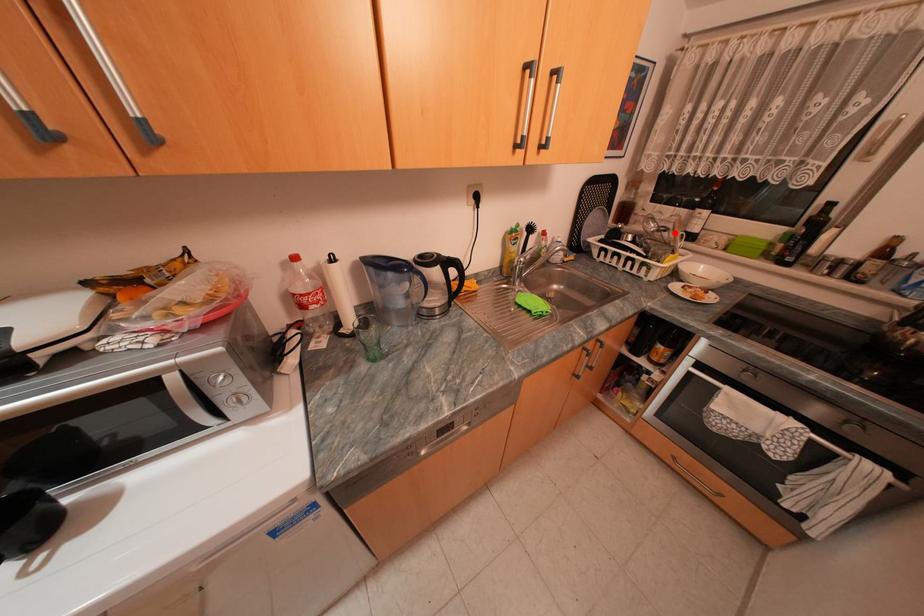
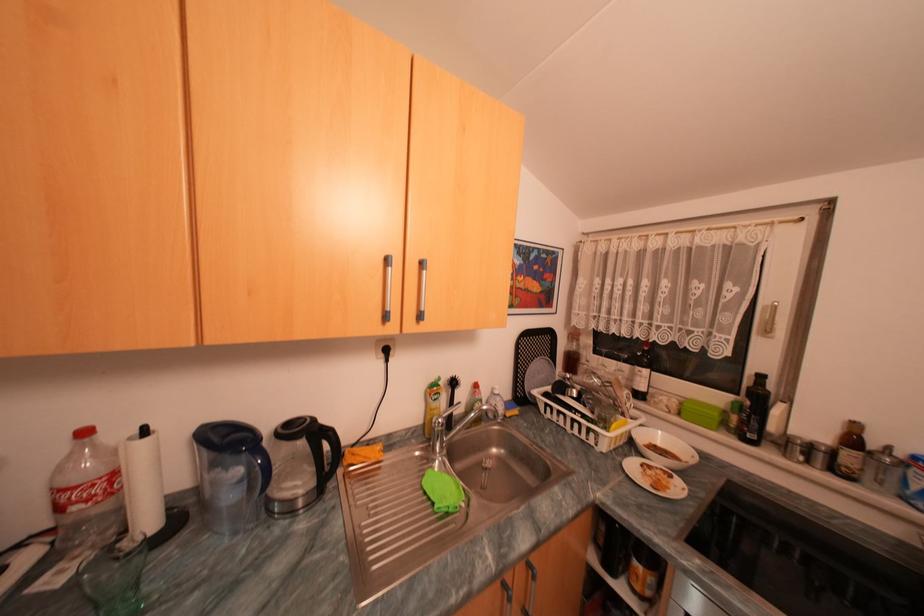
In the second image, find the point that corresponds to the highlighted location in the first image.

(622, 389)